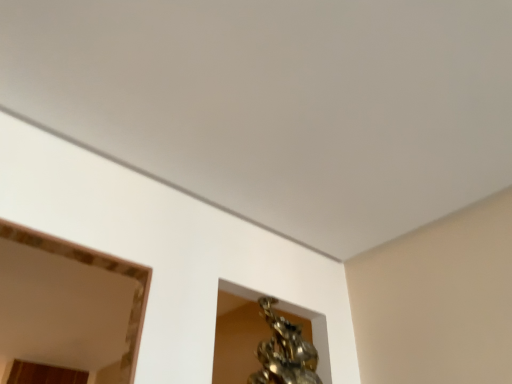
At what (x,y) coordinates should I click in order to perform the action: click on shiny bronze statue at upper center. Please return your answer as a coordinate pair (x, y). Image resolution: width=512 pixels, height=384 pixels. Looking at the image, I should click on (284, 352).

This screenshot has height=384, width=512. What do you see at coordinates (284, 352) in the screenshot?
I see `shiny bronze statue at upper center` at bounding box center [284, 352].

The image size is (512, 384). Describe the element at coordinates (96, 266) in the screenshot. I see `matte gold mirror at upper left` at that location.

I want to click on matte gold mirror at upper left, so click(x=96, y=266).

Locate an element on the screen. Image resolution: width=512 pixels, height=384 pixels. shiny bronze statue at upper center is located at coordinates (284, 352).

Considering the relative positions of shiny bronze statue at upper center and matte gold mirror at upper left in the image provided, is shiny bronze statue at upper center to the left or to the right of matte gold mirror at upper left?

In the image, shiny bronze statue at upper center appears on the right side of matte gold mirror at upper left.

Looking at this image, does shiny bronze statue at upper center come in front of matte gold mirror at upper left?

Yes, shiny bronze statue at upper center is closer to the camera.

Does point (287, 330) lie behind point (135, 319)?

Yes, it is.

From the image's perspective, between shiny bronze statue at upper center and matte gold mirror at upper left, which one is located above?

From the image's view, shiny bronze statue at upper center is above.

In the scene shown: From a real-world perspective, between shiny bronze statue at upper center and matte gold mirror at upper left, who is vertically lower?

In real-world perspective, shiny bronze statue at upper center is lower.

Is shiny bronze statue at upper center wider than matte gold mirror at upper left?

In fact, shiny bronze statue at upper center might be narrower than matte gold mirror at upper left.

Can you confirm if shiny bronze statue at upper center is shorter than matte gold mirror at upper left?

In fact, shiny bronze statue at upper center may be taller than matte gold mirror at upper left.

Is shiny bronze statue at upper center bigger or smaller than matte gold mirror at upper left?

Considering their sizes, shiny bronze statue at upper center takes up less space than matte gold mirror at upper left.

Does shiny bronze statue at upper center contain matte gold mirror at upper left?

No.

Are shiny bronze statue at upper center and matte gold mirror at upper left beside each other?

There is a gap between shiny bronze statue at upper center and matte gold mirror at upper left.

Is shiny bronze statue at upper center aimed at matte gold mirror at upper left?

No, shiny bronze statue at upper center does not turn towards matte gold mirror at upper left.

In the scene shown: How different are the orientations of shiny bronze statue at upper center and matte gold mirror at upper left in degrees?

The angular difference between shiny bronze statue at upper center and matte gold mirror at upper left is 179 degrees.

At what (x,y) coordinates should I click in order to perform the action: click on mirror that appears below the shiny bronze statue at upper center (from the image's perspective). Please return your answer as a coordinate pair (x, y). This screenshot has width=512, height=384. Looking at the image, I should click on (96, 266).

Which is more to the right, matte gold mirror at upper left or shiny bronze statue at upper center?

shiny bronze statue at upper center.

Which object is more forward, matte gold mirror at upper left or shiny bronze statue at upper center?

shiny bronze statue at upper center is closer to the camera.

Is point (138, 307) behind point (274, 378)?

No, (138, 307) is in front of (274, 378).

From the image's perspective, does matte gold mirror at upper left appear higher than shiny bronze statue at upper center?

No, from the image's perspective, matte gold mirror at upper left is not over shiny bronze statue at upper center.

From a real-world perspective, which is physically above, matte gold mirror at upper left or shiny bronze statue at upper center?

matte gold mirror at upper left is physically above.

Does matte gold mirror at upper left have a greater width compared to shiny bronze statue at upper center?

Yes, matte gold mirror at upper left is wider than shiny bronze statue at upper center.

Who is taller, matte gold mirror at upper left or shiny bronze statue at upper center?

With more height is shiny bronze statue at upper center.

Considering the relative sizes of matte gold mirror at upper left and shiny bronze statue at upper center in the image provided, is matte gold mirror at upper left bigger than shiny bronze statue at upper center?

Yes, matte gold mirror at upper left is bigger than shiny bronze statue at upper center.

Does matte gold mirror at upper left contain shiny bronze statue at upper center?

No, shiny bronze statue at upper center is located outside of matte gold mirror at upper left.

Based on the photo, is matte gold mirror at upper left positioned far away from shiny bronze statue at upper center?

matte gold mirror at upper left is actually quite close to shiny bronze statue at upper center.

Is matte gold mirror at upper left facing towards shiny bronze statue at upper center?

No, matte gold mirror at upper left does not turn towards shiny bronze statue at upper center.

This screenshot has height=384, width=512. I want to click on mirror on the left of shiny bronze statue at upper center, so click(96, 266).

Where is `bronze sculpture that is under the matte gold mirror at upper left (from a real-world perspective)`? bronze sculpture that is under the matte gold mirror at upper left (from a real-world perspective) is located at coordinates (284, 352).

Where is `bronze sculpture to the right of matte gold mirror at upper left`? This screenshot has width=512, height=384. bronze sculpture to the right of matte gold mirror at upper left is located at coordinates (284, 352).